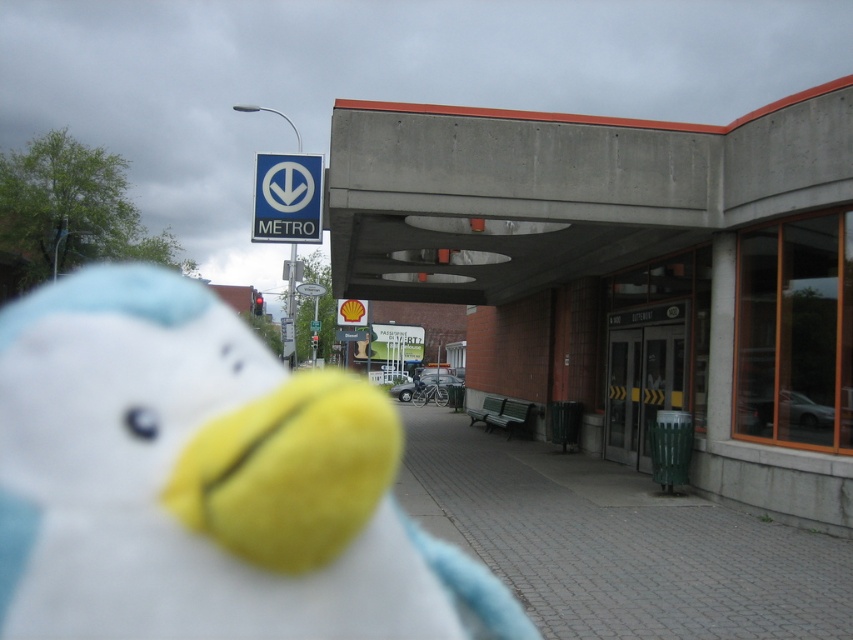
You are standing in front of the METERO station entrance and see the fluffy white toy at center and the blue plastic sign at upper center. Which object is closer to the ground?

The fluffy white toy at center is closer to the ground because it is below the blue plastic sign at upper center.

You are standing at the entrance of the M metro station and see two points marked on the ground. The first point is at position point (473, 429) and the second point is at point (308, 236). Which point is closer to you?

Point (308, 236) is closer to you because it is in front of point (473, 429).

You are a delivery robot with a 2.5 feet wide package. You need to navigate from the fluffy white toy at center to the paved brick sidewalk at center. Can you fit through the space between them?

The fluffy white toy at center and the paved brick sidewalk at center are 21.97 feet apart, so yes, the delivery robot with a 2.5 feet wide package can fit through the space between them since the distance is much wider than the package.